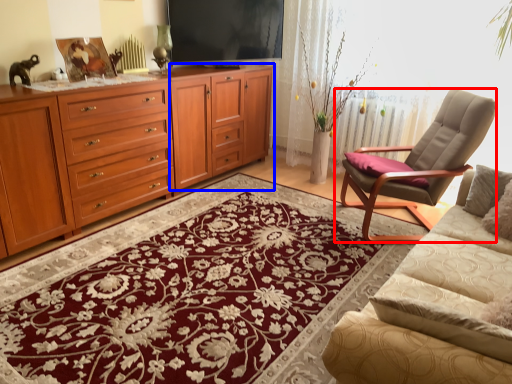
Question: Which object appears closest to the camera in this image, chair (highlighted by a red box) or tv cabinet (highlighted by a blue box)?

Choices:
 (A) chair
 (B) tv cabinet

Answer: (A)